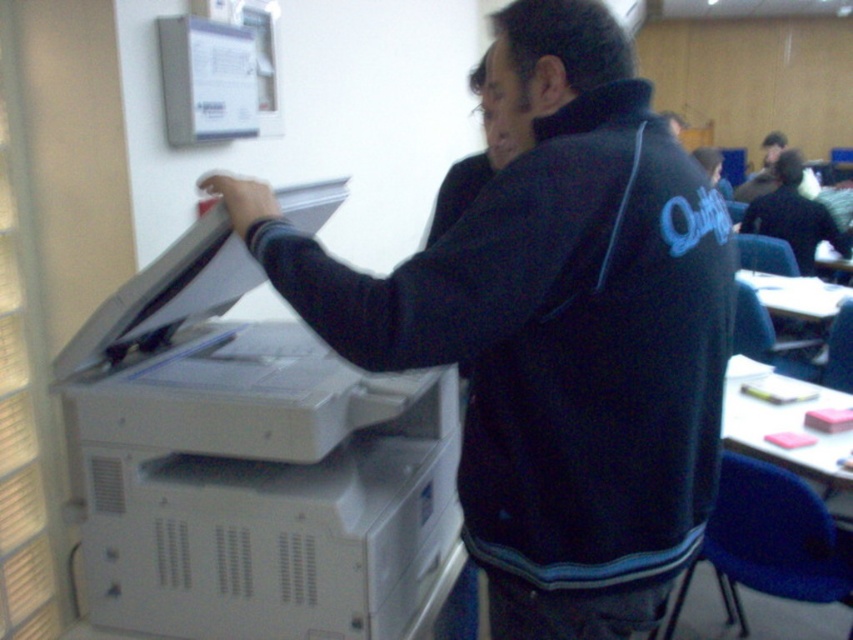
Question: Which of the following is the farthest from the observer?

Choices:
 (A) black matte jacket at center
 (B) white paper at upper center
 (C) white plastic printer at left

Answer: (B)

Question: In this image, where is white plastic printer at left located relative to white paper at upper center?

Choices:
 (A) right
 (B) left

Answer: (A)

Question: Which object is closer to the camera taking this photo?

Choices:
 (A) white plastic printer at left
 (B) black matte jacket at center

Answer: (B)

Question: Does white plastic printer at left lie in front of white paper at upper center?

Choices:
 (A) yes
 (B) no

Answer: (A)

Question: Which of these objects is positioned closest to the white plastic printer at left?

Choices:
 (A) white paper at upper center
 (B) black matte jacket at center

Answer: (B)

Question: Is white plastic printer at left wider than white paper at upper center?

Choices:
 (A) no
 (B) yes

Answer: (B)